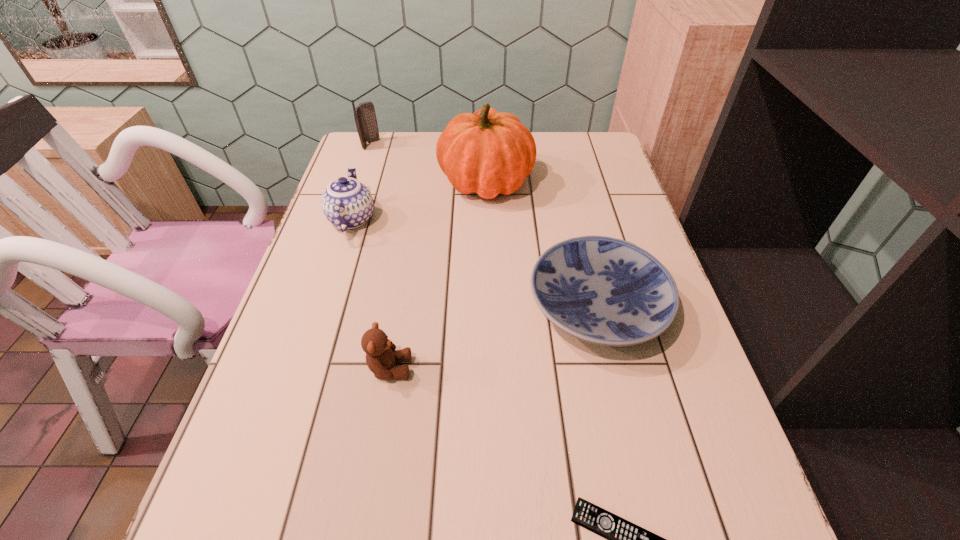
Where is `pumpkin`? The height and width of the screenshot is (540, 960). pumpkin is located at coordinates (489, 153).

What are the coordinates of `cellular telephone` in the screenshot? It's located at (365, 117).

This screenshot has height=540, width=960. In order to click on the farthest object in this screenshot , I will do `click(365, 117)`.

Where is `chinaware`? This screenshot has width=960, height=540. chinaware is located at coordinates (347, 203).

The image size is (960, 540). I want to click on the third shortest object, so click(381, 355).

Locate an element on the screen. the third object from left to right is located at coordinates [x=381, y=355].

The width and height of the screenshot is (960, 540). In order to click on the fifth tallest object in this screenshot , I will do `click(602, 290)`.

The width and height of the screenshot is (960, 540). What are the coordinates of `vacant point located 0.220m on the right of the pumpkin` in the screenshot? It's located at (608, 181).

At what (x,y) coordinates should I click in order to perform the action: click on free space located 0.230m on the keyboard of the second tallest object. Please return your answer as a coordinate pair (x, y). This screenshot has width=960, height=540. Looking at the image, I should click on (448, 145).

This screenshot has width=960, height=540. In order to click on vacant area situated 0.220m at the spout of the chinaware in this screenshot , I will do `click(372, 155)`.